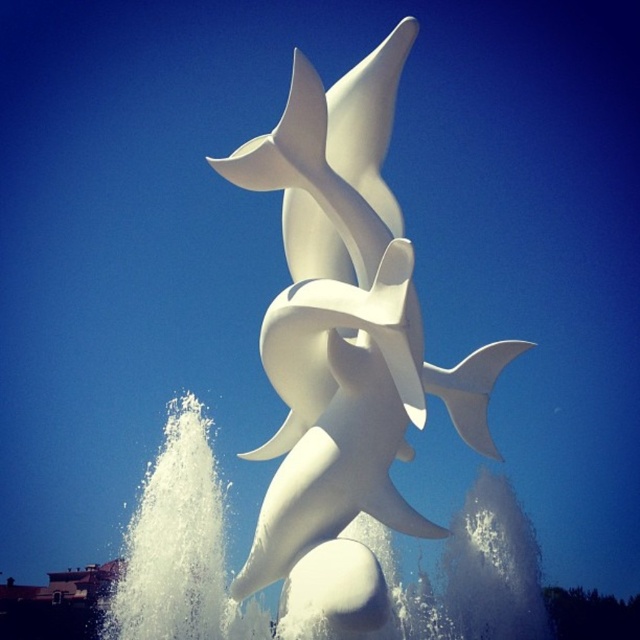
You are standing in front of a sculpture of three dolphins against a blue sky. The dolphins are arranged in a way that their bodies flow into each other. There is a specific point at coordinates point (x=344, y=337). What does this point represent?

The point (x=344, y=337) corresponds to the white glossy dolphins at center.